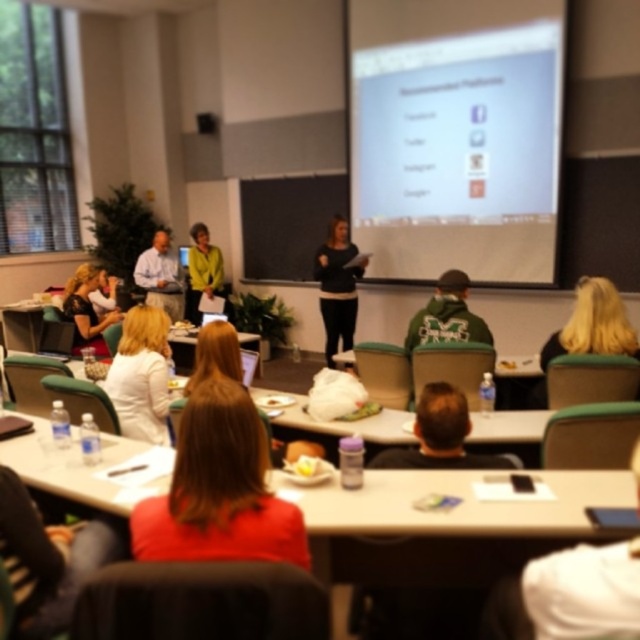
Who is positioned more to the left, white fabric shirt at lower right or white fabric shirt at center?

Positioned to the left is white fabric shirt at center.

Measure the distance between point (x=561, y=620) and camera.

Point (x=561, y=620) and camera are 4.25 feet apart.

What do you see at coordinates (584, 592) in the screenshot?
I see `white fabric shirt at lower right` at bounding box center [584, 592].

Locate an element on the screen. The image size is (640, 640). white fabric shirt at lower right is located at coordinates (584, 592).

Who is more distant from viewer, (433,381) or (406,346)?

Point (406,346)

Which is in front, point (394, 458) or point (433, 301)?

Point (394, 458) is in front.

In order to click on brown hair at center in this screenshot , I will do tap(440, 436).

Which is above, brown hair at center or light blue shirt at center?

light blue shirt at center

Can you confirm if brown hair at center is smaller than light blue shirt at center?

Yes, brown hair at center is smaller than light blue shirt at center.

Between point (464, 397) and point (145, 272), which one is positioned behind?

Point (145, 272)

At what (x,y) coordinates should I click in order to perform the action: click on brown hair at center. Please return your answer as a coordinate pair (x, y). The image size is (640, 640). Looking at the image, I should click on (440, 436).